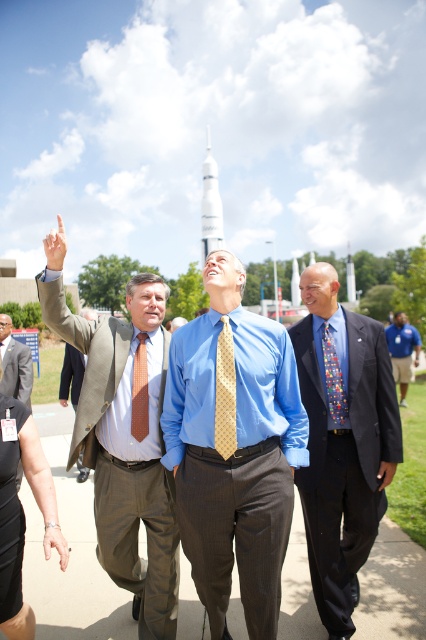
Does dark blue suit at center appear on the left side of white glossy rocket at center?

In fact, dark blue suit at center is to the right of white glossy rocket at center.

Which is more to the left, dark blue suit at center or white glossy rocket at center?

white glossy rocket at center

Describe the element at coordinates (342, 442) in the screenshot. Image resolution: width=426 pixels, height=640 pixels. I see `dark blue suit at center` at that location.

Where is `dark blue suit at center`? dark blue suit at center is located at coordinates (342, 442).

Which is more to the left, matte brown suit at center or yellow dotted tie at center?

From the viewer's perspective, matte brown suit at center appears more on the left side.

Which is more to the right, matte brown suit at center or yellow dotted tie at center?

From the viewer's perspective, yellow dotted tie at center appears more on the right side.

Where is `matte brown suit at center`? matte brown suit at center is located at coordinates (121, 460).

This screenshot has width=426, height=640. I want to click on matte brown suit at center, so click(x=121, y=460).

Looking at this image, how distant is matte brown suit at center from blue shirt at center?

18.50 meters

Between matte brown suit at center and blue shirt at center, which one appears on the right side from the viewer's perspective?

blue shirt at center is more to the right.

Which is in front, point (161, 600) or point (403, 356)?

Positioned in front is point (161, 600).

Where is `matte brown suit at center`? This screenshot has width=426, height=640. matte brown suit at center is located at coordinates (121, 460).